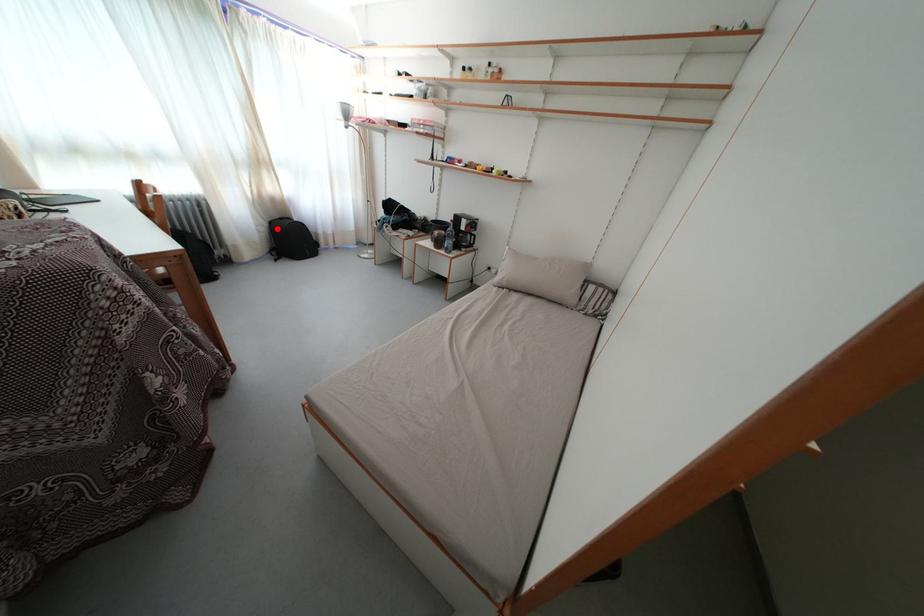
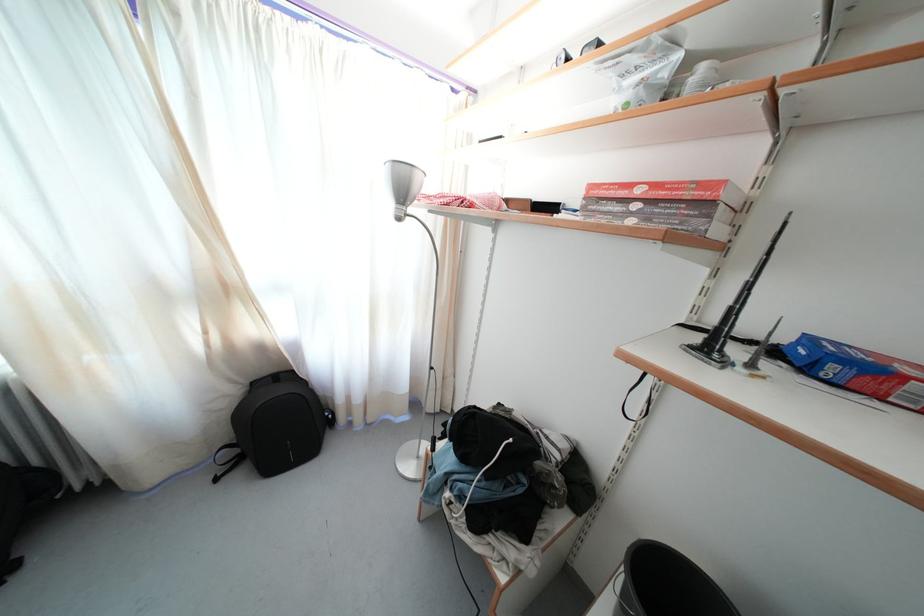
Question: I am providing you with two images of the same scene from different viewpoints. In image1, a red point is highlighted. Considering the same 3D point in image2, which of the following is correct?

Choices:
 (A) It is closer
 (B) It is farther

Answer: (B)